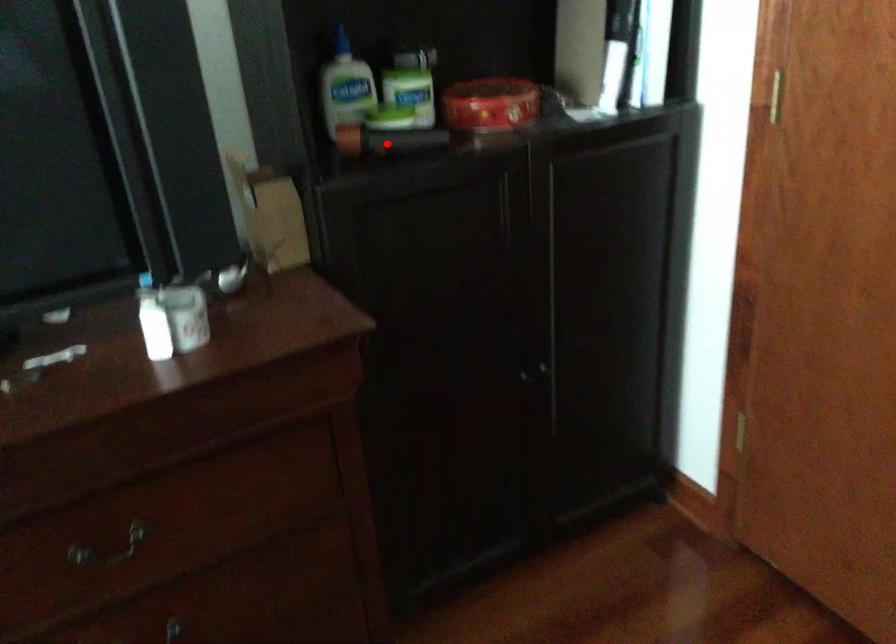
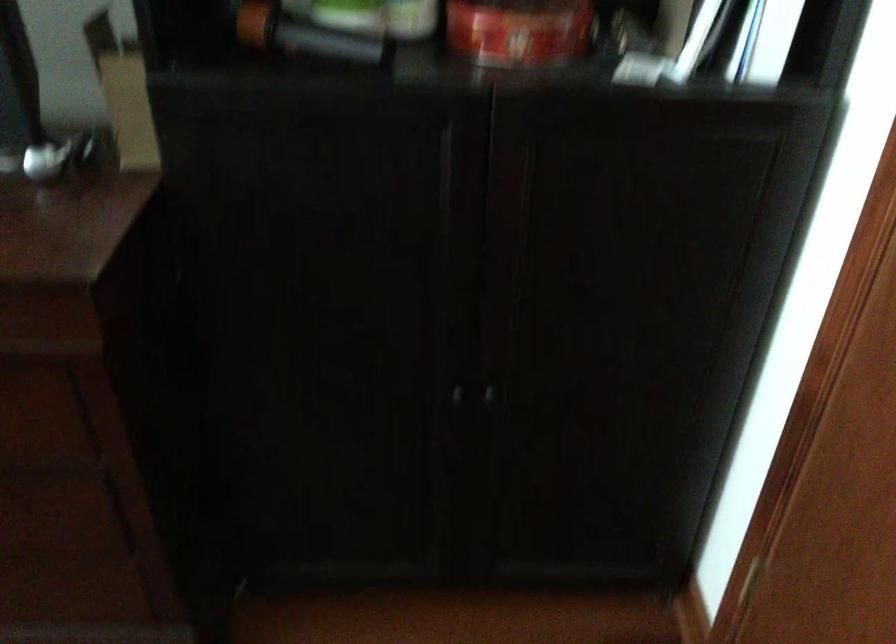
The point at the highlighted location is marked in the first image. Where is the corresponding point in the second image?

(304, 35)